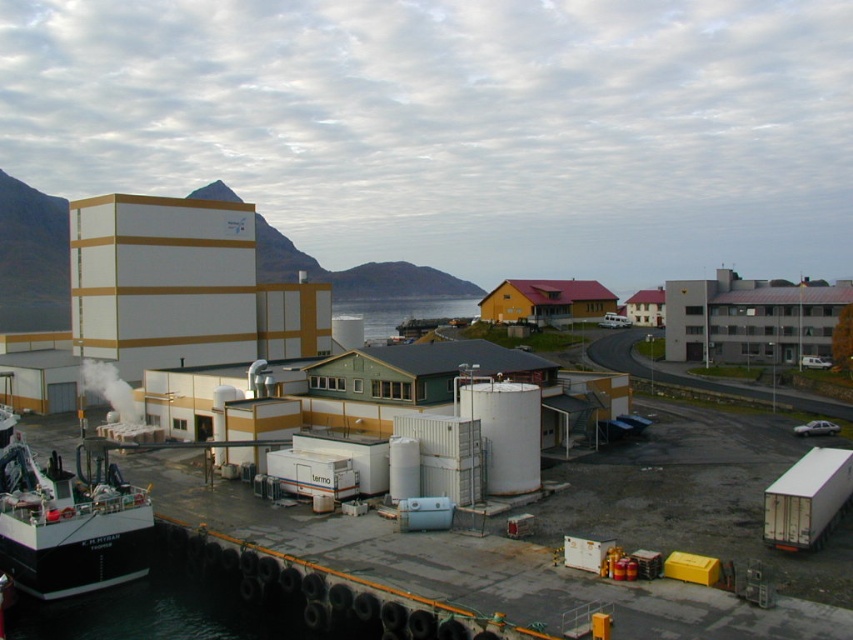
You are a harbor inspector standing at the camera position. You need to inspect the black matte boat at lower left. Is it within the safe inspection distance of 30 meters?

The black matte boat at lower left is 35.70 meters away from camera, so it is beyond the safe inspection distance of 30 meters. You need to move closer.

You are a harbor inspector checking the docking area. You need to determine if there is enough space between the black matte boat at lower left and the transparent water at center for a new cargo container. Based on their sizes, can you confirm if there is sufficient space?

The black matte boat at lower left occupies less space than transparent water at center, so there is enough space between them to accommodate a new cargo container.